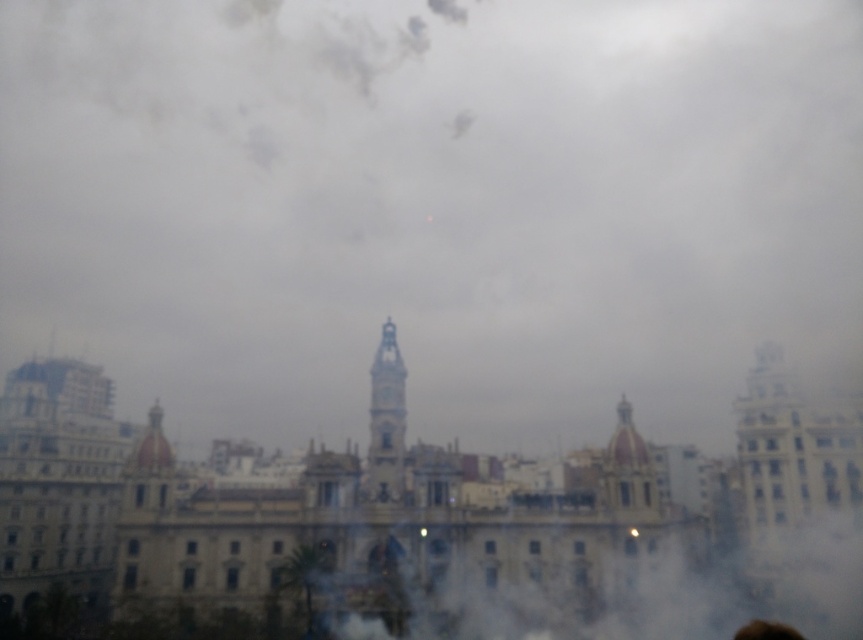
Can you confirm if white cotton cloud at upper center is shorter than brown hair at upper center?

In fact, white cotton cloud at upper center may be taller than brown hair at upper center.

Between white cotton cloud at upper center and brown hair at upper center, which one appears on the right side from the viewer's perspective?

From the viewer's perspective, brown hair at upper center appears more on the right side.

Between point (109, 352) and point (754, 636), which one is positioned behind?

The point (109, 352) is more distant.

Locate an element on the screen. The image size is (863, 640). white cotton cloud at upper center is located at coordinates (433, 209).